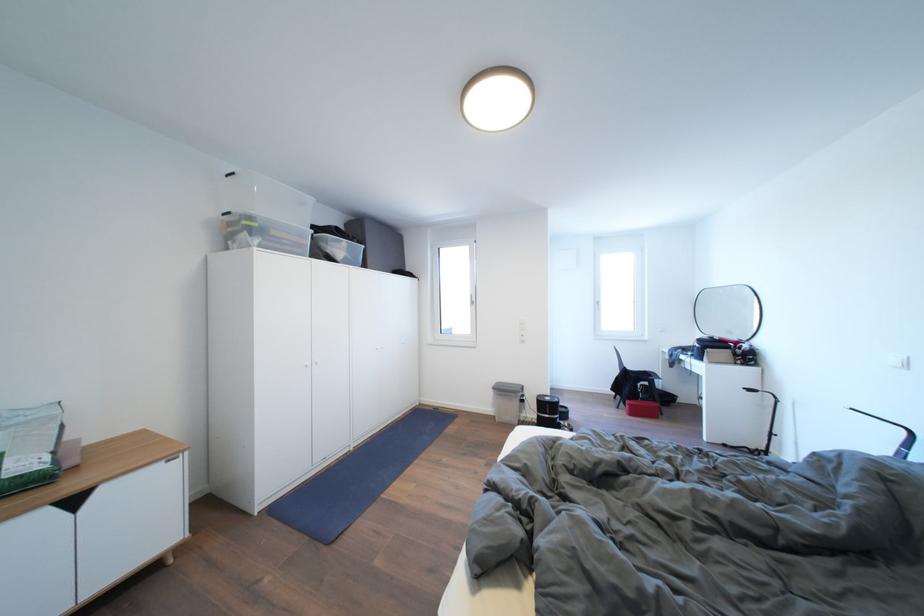
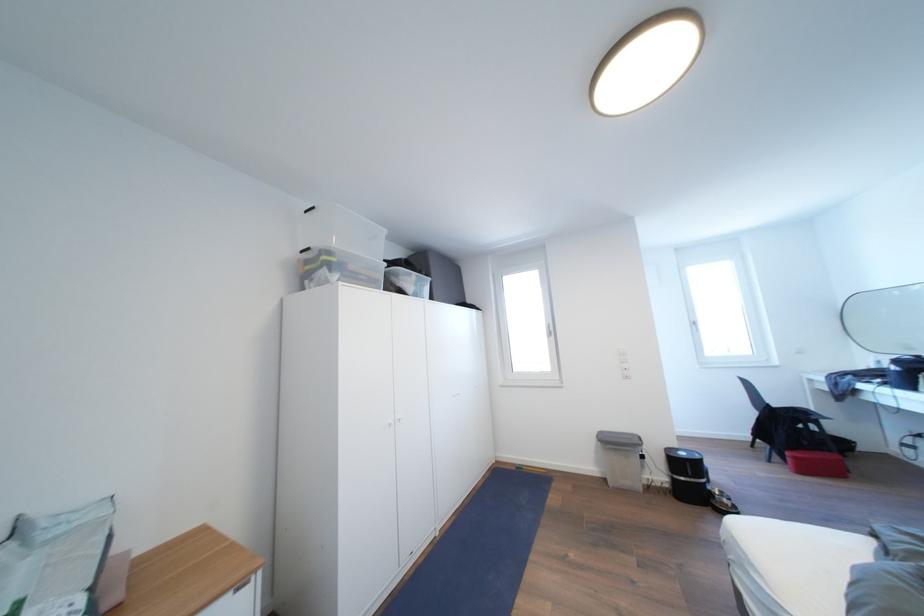
The point at [555,403] is marked in the first image. Where is the corresponding point in the second image?

(689, 459)